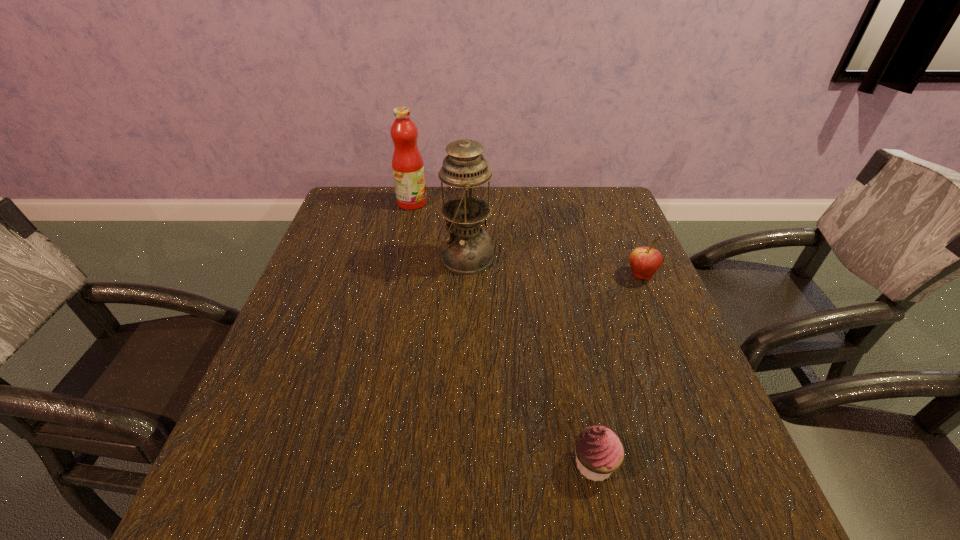
The image size is (960, 540). I want to click on object situated at the far edge, so click(x=407, y=163).

This screenshot has height=540, width=960. Identify the location of object situated at the near edge. (599, 452).

Locate an element on the screen. object that is positioned at the right edge is located at coordinates (644, 261).

You are a GUI agent. You are given a task and a screenshot of the screen. Output one action in this format:
    pyautogui.click(x=<x>, y=<y>)
    Task: Click on the free region at the far edge of the desktop
    
    Given the screenshot: What is the action you would take?
    pyautogui.click(x=548, y=214)

Where is `vacant space at the left edge of the desktop`? Image resolution: width=960 pixels, height=540 pixels. vacant space at the left edge of the desktop is located at coordinates (322, 242).

The height and width of the screenshot is (540, 960). Identify the location of vacant space at the right edge. (616, 363).

Identify the location of blank area at the far left corner. The width and height of the screenshot is (960, 540). (377, 193).

Where is `vacant space at the near left corner of the desktop`? Image resolution: width=960 pixels, height=540 pixels. vacant space at the near left corner of the desktop is located at coordinates (278, 524).

Locate an element on the screen. This screenshot has width=960, height=540. free space at the far right corner of the desktop is located at coordinates (576, 194).

Image resolution: width=960 pixels, height=540 pixels. In the image, there is a desktop. In order to click on free space at the near right corner in this screenshot , I will do `click(674, 482)`.